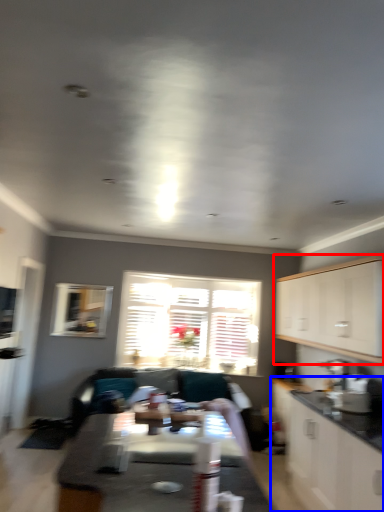
Question: Which object appears closest to the camera in this image, cabinetry (highlighted by a red box) or cabinetry (highlighted by a blue box)?

Choices:
 (A) cabinetry
 (B) cabinetry

Answer: (B)